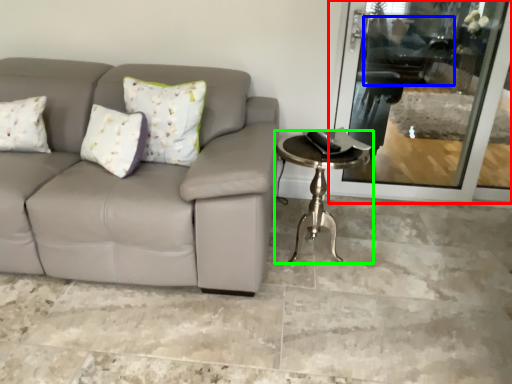
Question: Which object is the closest to the screen door (highlighted by a red box)? Choose among these: swivel chair (highlighted by a blue box) or table (highlighted by a green box).

Choices:
 (A) swivel chair
 (B) table

Answer: (A)